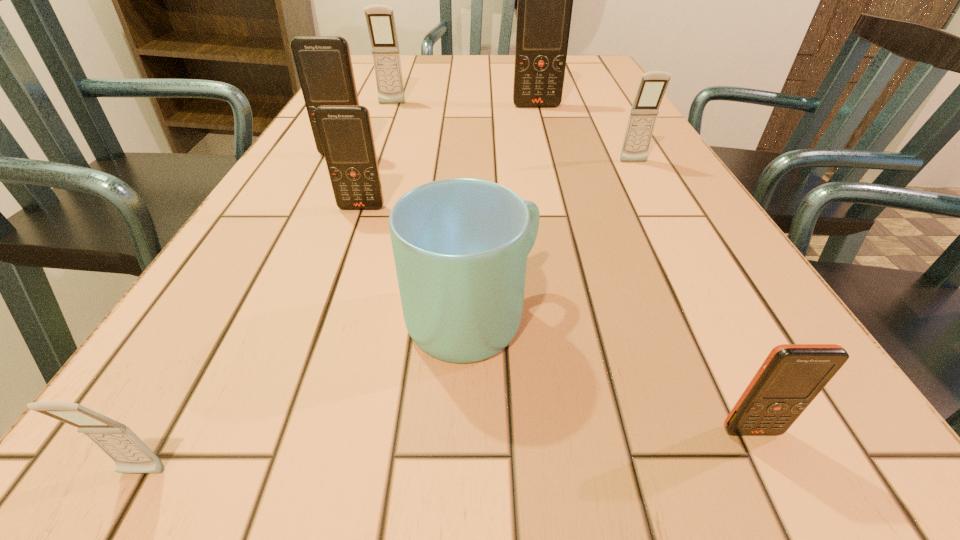
What are the coordinates of `free space located 0.200m on the screen of the second nearest orange cellular telephone` in the screenshot? It's located at (332, 291).

Identify the location of free location located on the right of the fifth object from left to right. The image size is (960, 540). (721, 318).

Identify the location of free space located on the screen of the sixth farthest cellular telephone. Image resolution: width=960 pixels, height=540 pixels. (791, 509).

Identify the location of free location at the far edge of the desktop. The width and height of the screenshot is (960, 540). (508, 70).

Where is `vacant space at the left edge of the desktop`? The width and height of the screenshot is (960, 540). vacant space at the left edge of the desktop is located at coordinates (365, 86).

In the image, there is a desktop. Where is `free space at the right edge`? free space at the right edge is located at coordinates (616, 124).

Locate an element on the screen. This screenshot has width=960, height=540. blank area at the far right corner is located at coordinates (569, 63).

You are a GUI agent. You are given a task and a screenshot of the screen. Output one action in this format:
    pyautogui.click(x=<x>, y=<y>)
    Task: Click on the free space between the tallest cellular telephone and the second biggest gray cellular telephone
    The height and width of the screenshot is (540, 960).
    Given the screenshot: What is the action you would take?
    pyautogui.click(x=586, y=134)

Where is `vacant area between the farthest orange cellular telephone and the fourth nearest object`? The height and width of the screenshot is (540, 960). vacant area between the farthest orange cellular telephone and the fourth nearest object is located at coordinates (449, 157).

Find the location of a particular element. The image size is (960, 540). empty location between the rightmost orange cellular telephone and the farthest orange cellular telephone is located at coordinates (644, 268).